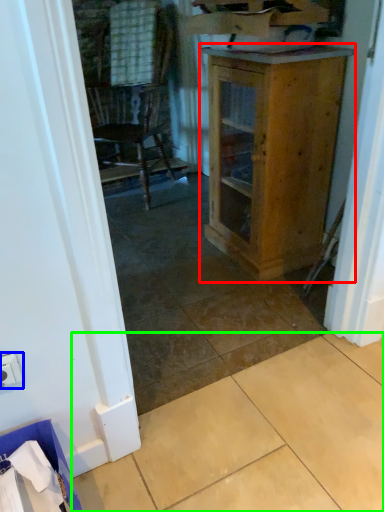
Question: Which object is positioned closest to cabinetry (highlighted by a red box)? Select from electric outlet (highlighted by a blue box) and tile (highlighted by a green box).

Choices:
 (A) electric outlet
 (B) tile

Answer: (B)